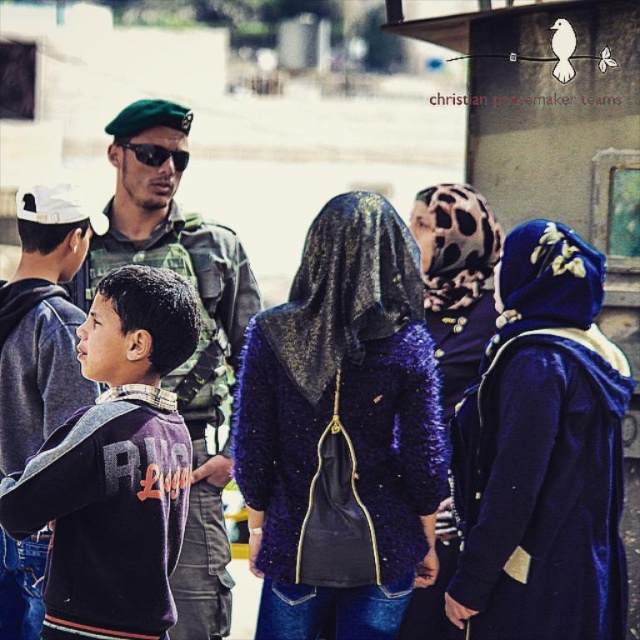
You are standing in the public space and see a shiny blue jacket at center. Where is the point with coordinates point at (342, 422) located?

The point at (342, 422) is located on the shiny blue jacket at center.